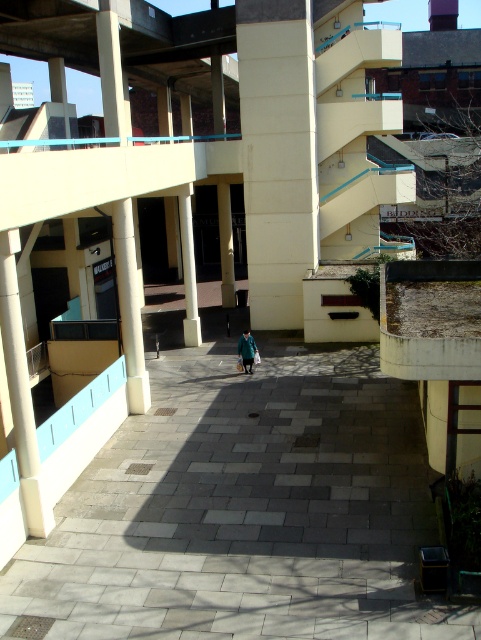
You are a maintenance worker needing to place a 10 feet long safety barrier between the beige concrete pillar at center and the white concrete pillar at center. Can the barrier fit between them without overlapping the pillars?

The distance between beige concrete pillar at center and white concrete pillar at center is 12.62 feet, which is longer than the 10 feet barrier. Therefore, the barrier can fit between them with some space remaining.

You are standing at the point marked by the coordinates point (278,154) in the parking structure. Looking around, you see the beige concrete pillar at center. Which direction should you walk to reach the pedestrian walkway paved with rectangular stone tiles in shades of gray and black?

The pedestrian walkway is located away from the beige concrete pillar at center, so you should walk towards the direction opposite of the beige concrete pillar at center to reach the walkway.